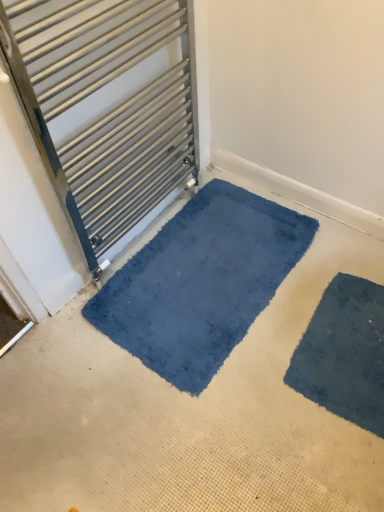
The width and height of the screenshot is (384, 512). Find the location of `vacant space situated on the left part of dark blue plush bath mat at lower right`. vacant space situated on the left part of dark blue plush bath mat at lower right is located at coordinates (254, 387).